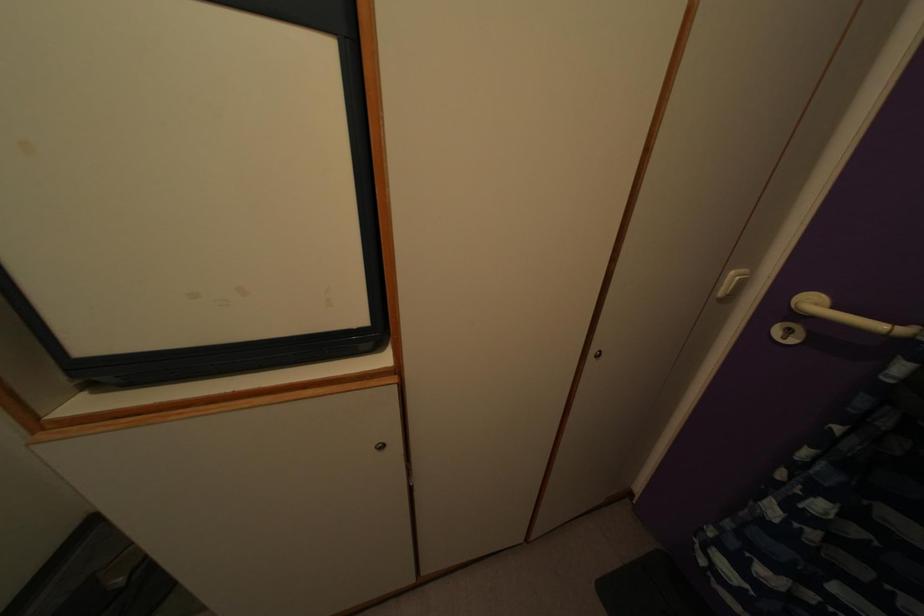
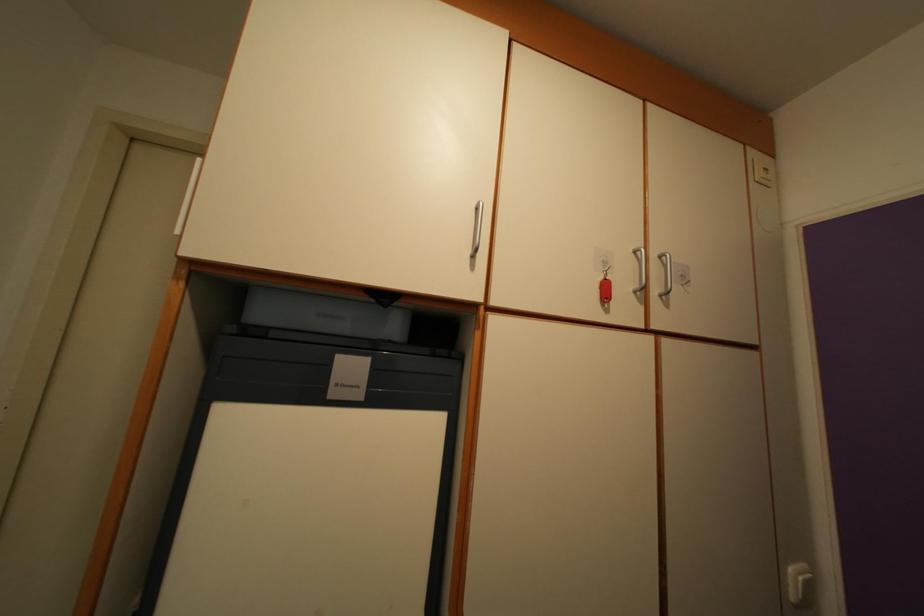
Question: Based on the continuous images, in which direction is the camera rotating? Reply with the corresponding letter.

Choices:
 (A) Left
 (B) Right
 (C) Up
 (D) Down

Answer: (C)